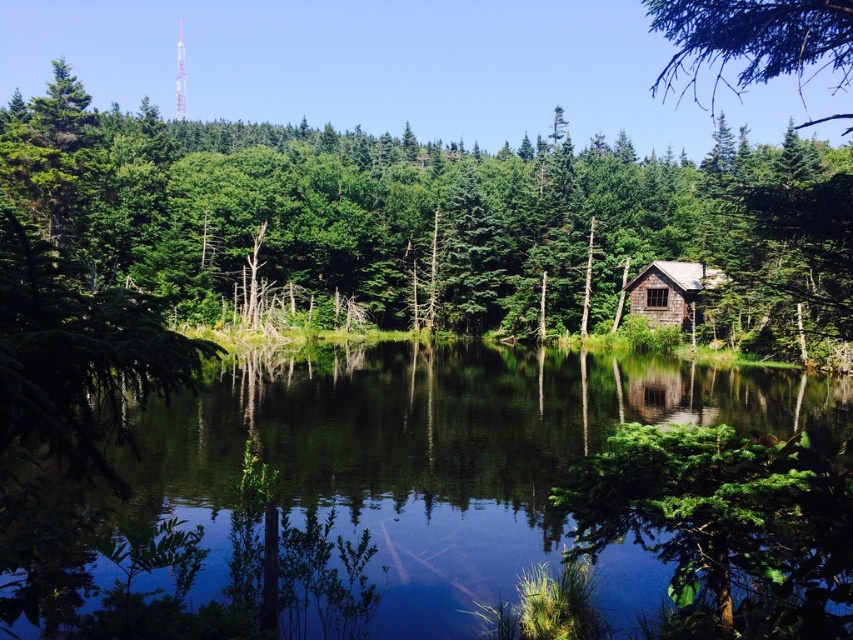
Can you confirm if green matte tree at center is bigger than green matte tree at lower right?

Yes, green matte tree at center is bigger than green matte tree at lower right.

Is green matte tree at center above green matte tree at lower right?

Correct, green matte tree at center is located above green matte tree at lower right.

This screenshot has width=853, height=640. What do you see at coordinates (432, 220) in the screenshot? I see `green matte tree at center` at bounding box center [432, 220].

Where is `green matte tree at center`? green matte tree at center is located at coordinates (432, 220).

From the picture: Can you confirm if green reflective water at center is bigger than green rough bark branch at upper right?

Incorrect, green reflective water at center is not larger than green rough bark branch at upper right.

Does green reflective water at center have a lesser width compared to green rough bark branch at upper right?

Correct, green reflective water at center's width is less than green rough bark branch at upper right's.

Where is `green reflective water at center`? green reflective water at center is located at coordinates (434, 458).

I want to click on green reflective water at center, so click(x=434, y=458).

Does point (50, 349) lie behind point (767, 56)?

No.

Based on the photo, does green matte tree at left lie behind green rough bark branch at upper right?

No, green matte tree at left is in front of green rough bark branch at upper right.

Where is `green matte tree at left`? Image resolution: width=853 pixels, height=640 pixels. green matte tree at left is located at coordinates (79, 358).